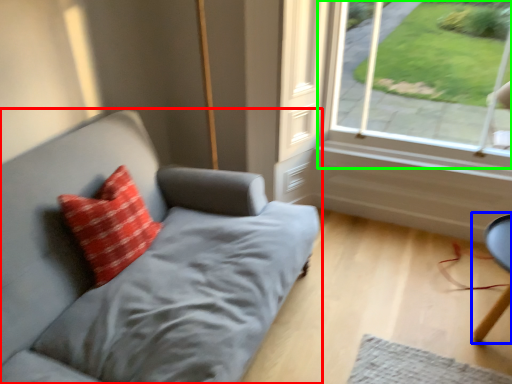
Question: Considering the real-world distances, which object is farthest from studio couch (highlighted by a red box)? computer chair (highlighted by a blue box) or window (highlighted by a green box)?

Choices:
 (A) computer chair
 (B) window

Answer: (A)